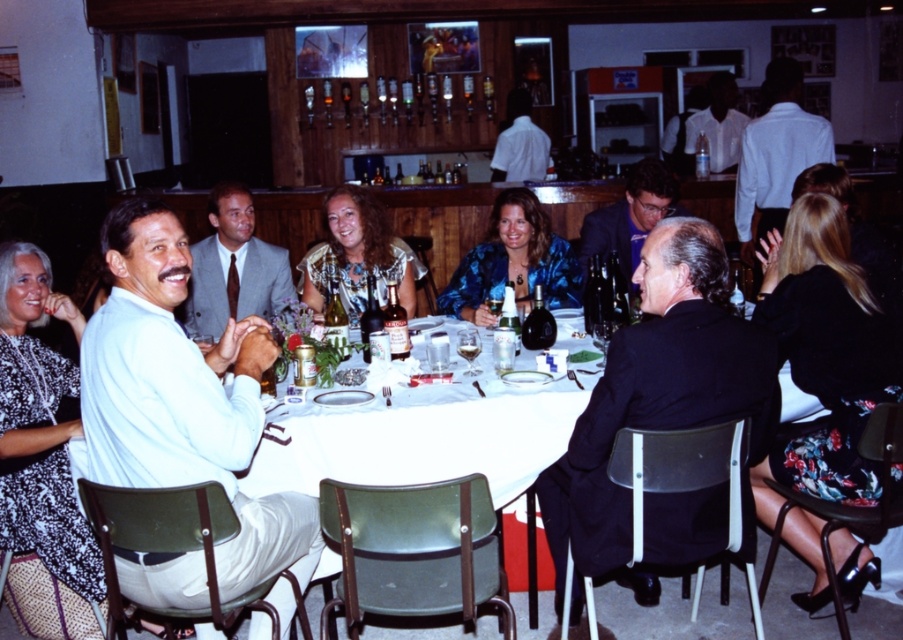
Can you confirm if white plastic table at center is bigger than patterned fabric blouse at center?

Yes, white plastic table at center is bigger than patterned fabric blouse at center.

Who is more forward, (543, 401) or (333, 244)?

Point (543, 401) is more forward.

Describe the element at coordinates (427, 444) in the screenshot. I see `white plastic table at center` at that location.

This screenshot has height=640, width=903. I want to click on white plastic table at center, so click(427, 444).

Between point (522, 509) and point (479, 250), which one is positioned in front?

Point (522, 509) is more forward.

This screenshot has height=640, width=903. In order to click on white plastic table at center in this screenshot , I will do `click(427, 444)`.

Is blue textured jacket at center positioned behind patterned fabric blouse at center?

No, blue textured jacket at center is closer to the viewer.

Is the position of blue textured jacket at center less distant than that of patterned fabric blouse at center?

Yes, blue textured jacket at center is in front of patterned fabric blouse at center.

This screenshot has height=640, width=903. In order to click on blue textured jacket at center in this screenshot , I will do `click(513, 262)`.